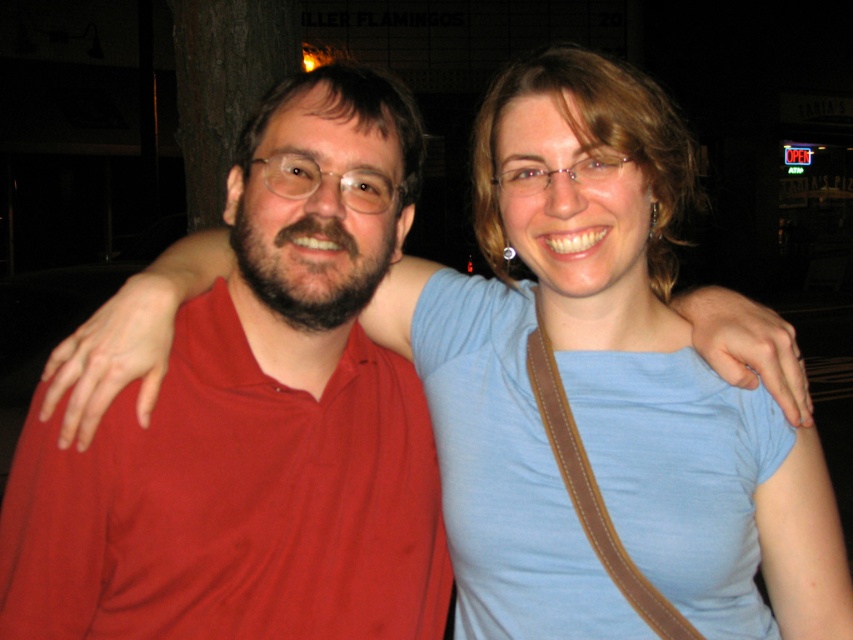
Which is in front, point (689, 528) or point (259, 234)?

Point (689, 528) is in front.

Measure the distance between point (x=697, y=435) and camera.

They are 4.25 feet apart.

Who is more forward, (675,628) or (403,216)?

Point (675,628) is more forward.

Find the location of a particular element. blue cotton shirt at upper right is located at coordinates (606, 396).